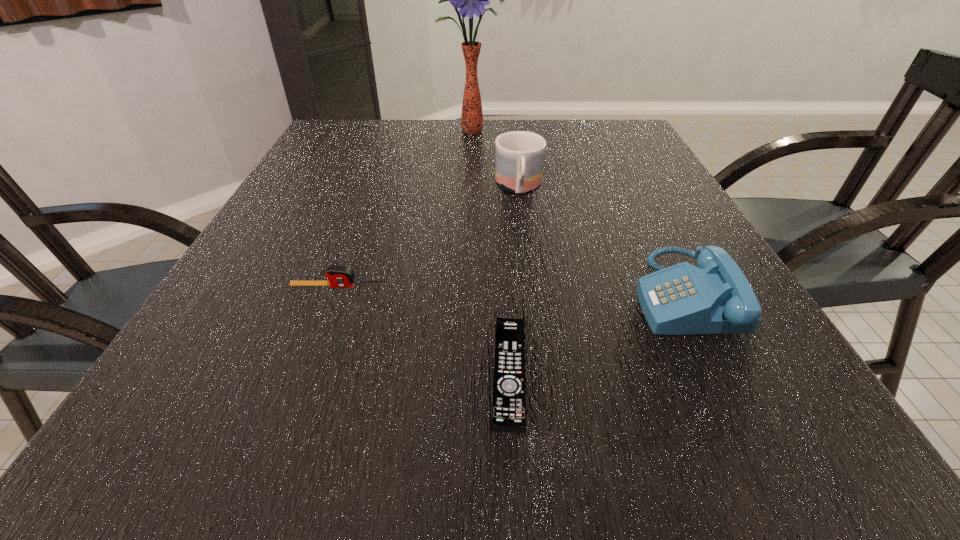
You are a GUI agent. You are given a task and a screenshot of the screen. Output one action in this format:
    pyautogui.click(x=<x>, y=<y>)
    Task: Click on the free space between the remote control and the telephone
    Image resolution: width=960 pixels, height=540 pixels.
    Given the screenshot: What is the action you would take?
    pyautogui.click(x=595, y=333)

Locate an element on the screen. Image resolution: width=960 pixels, height=540 pixels. vacant area that lies between the telephone and the mug is located at coordinates (600, 241).

The width and height of the screenshot is (960, 540). What are the coordinates of `free space that is in between the tape measure and the remote control` in the screenshot? It's located at (424, 329).

The image size is (960, 540). What are the coordinates of `free space between the telephone and the flower arrangement` in the screenshot? It's located at (577, 212).

Identify the location of object that is the second nearest to the flower arrangement. (715, 297).

Identify the location of the fourth closest object to the farthest object. (509, 391).

Locate an element on the screen. free location that satisfies the following two spatial constraints: 1. on the back side of the fourth tallest object; 2. on the left side of the flower arrangement is located at coordinates (395, 131).